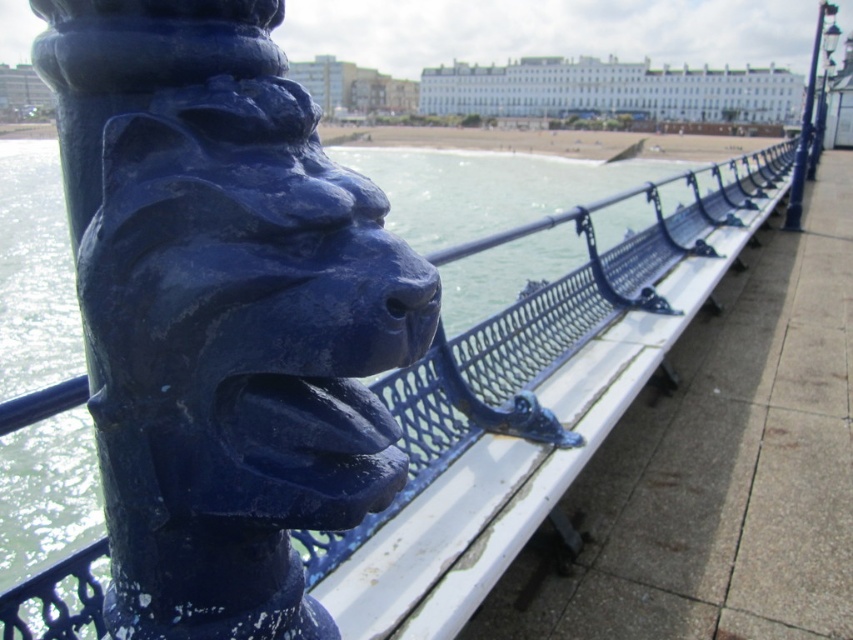
Question: Is matte blue lion head at center smaller than smooth sand beach at center?

Choices:
 (A) yes
 (B) no

Answer: (A)

Question: Can you confirm if matte blue lion head at center is smaller than blue painted metal pole at upper right?

Choices:
 (A) yes
 (B) no

Answer: (A)

Question: Is matte blue lion head at center below blue painted metal pole at upper right?

Choices:
 (A) yes
 (B) no

Answer: (A)

Question: Which of these objects is positioned closest to the smooth sand beach at center?

Choices:
 (A) glossy metal fence at center
 (B) blue painted metal pole at upper right
 (C) matte blue lion head at center

Answer: (C)

Question: Which is nearer to the matte blue lion head at center?

Choices:
 (A) smooth sand beach at center
 (B) glossy metal fence at center

Answer: (B)

Question: Which point appears farthest from the camera in this image?

Choices:
 (A) (764, 145)
 (B) (152, 291)
 (C) (822, 22)
 (D) (42, 593)

Answer: (A)